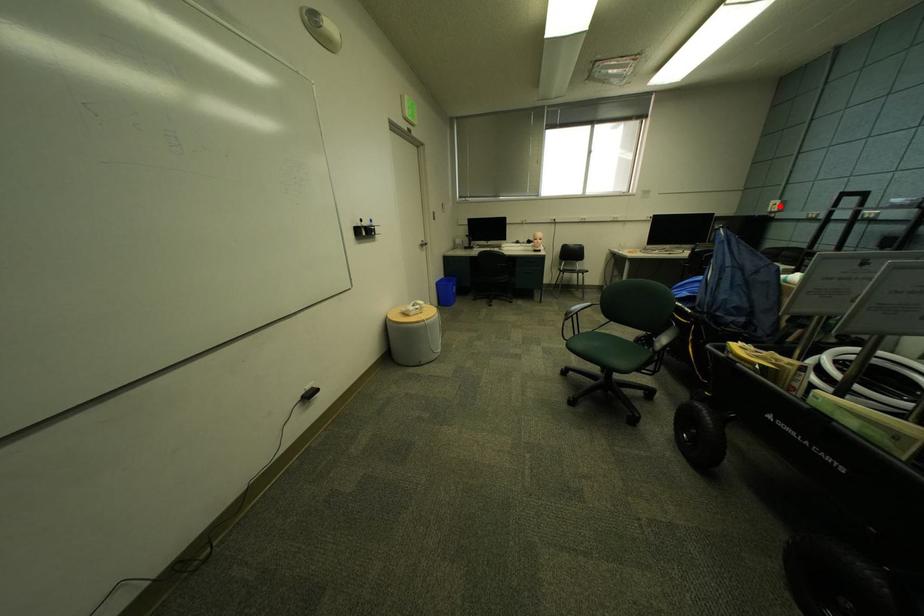
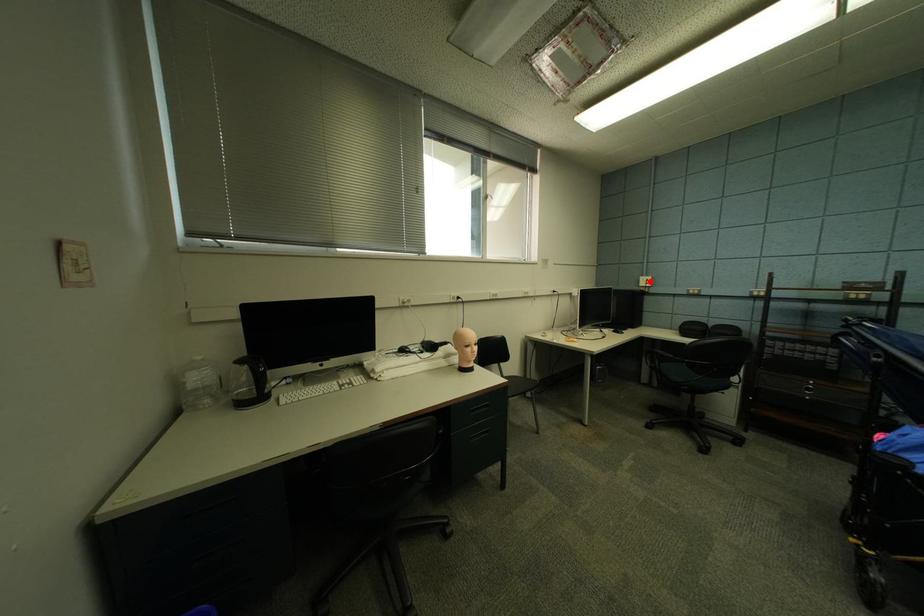
I am providing you with two images of the same scene from different viewpoints. A red point is marked on the first image and another point is marked on the second image. Do the highlighted points in image1 and image2 indicate the same real-world spot?

Yes